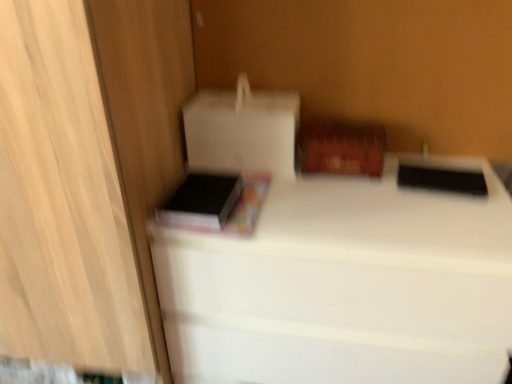
The width and height of the screenshot is (512, 384). Find the location of `vacant space in front of cardboard box at upper right, marked as the 1th cardboard box in a right-to-left arrangement`. vacant space in front of cardboard box at upper right, marked as the 1th cardboard box in a right-to-left arrangement is located at coordinates (362, 208).